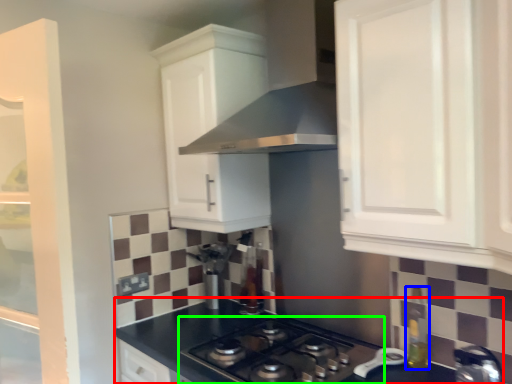
Question: Considering the real-world distances, which object is closest to countertop (highlighted by a red box)? bottle (highlighted by a blue box) or gas stove (highlighted by a green box).

Choices:
 (A) bottle
 (B) gas stove

Answer: (B)